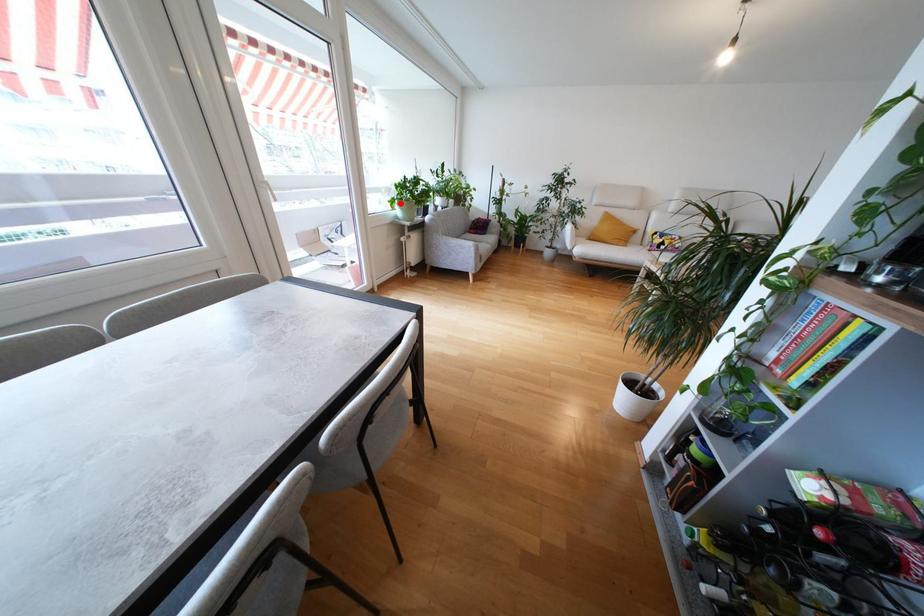
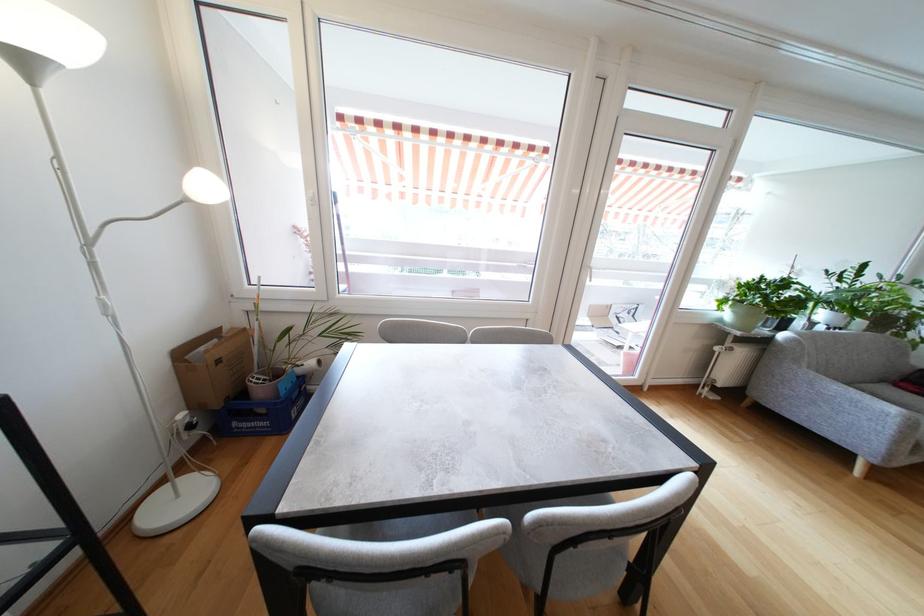
Question: I am providing you with two images of the same scene from different viewpoints. A red point is marked on the first image. At the location where the point appears in image 1, is it still visible in image 2?

Choices:
 (A) Yes
 (B) No

Answer: (A)